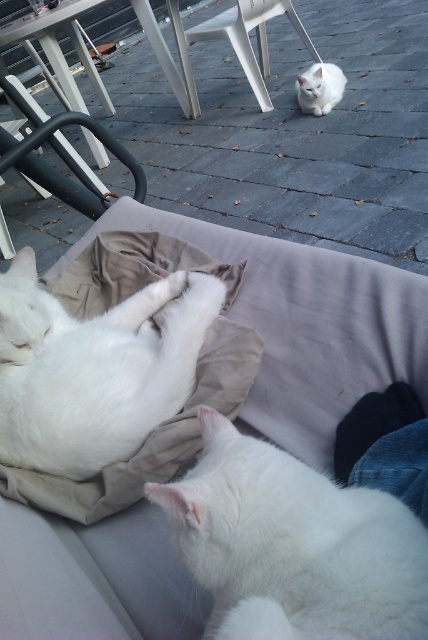
You are a photographer setting up a tripod to take a photo of the white fluffy cat at lower right and the white plastic chair at upper center. The tripod needs to be positioned so that both subjects are in frame. Considering their heights, which subject should be placed closer to the camera to ensure both are fully visible without cropping?

The white fluffy cat at lower right is shorter than the white plastic chair at upper center. To ensure both are fully visible, the white fluffy cat at lower right should be placed closer to the camera so its height matches the chair in the frame.

You are a cat owner who wants to ensure your cats have enough space to move around. You have a cat that needs at least 60 centimeters of space to stretch comfortably. Based on the scene, can the white fluffy cat at center comfortably stretch next to the black metal chair at upper left?

The distance between the white fluffy cat at center and the black metal chair at upper left is 63.68 centimeters, which is more than the required 60 centimeters. Therefore, the white fluffy cat at center has enough space to stretch comfortably next to the black metal chair at upper left.

You are standing at the center of the image and want to locate the white fluffy cat at lower right. According to the coordinates provided, in which direction should you look to find it?

The white fluffy cat at lower right is located at coordinates point (294, 545), which is to the right and slightly below the center of the image. So you should look to the right and downward from your current position at the center to locate it.